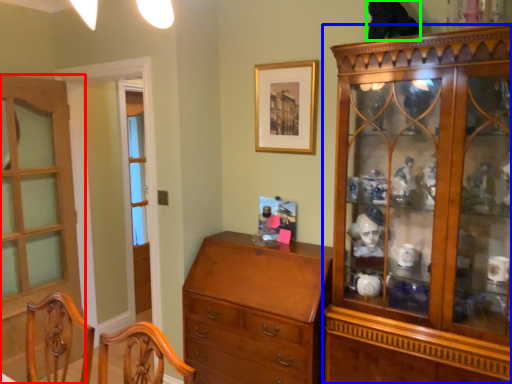
Question: Which object is the closest to the door (highlighted by a red box)? Choose among these: cabinetry (highlighted by a blue box) or animal (highlighted by a green box).

Choices:
 (A) cabinetry
 (B) animal

Answer: (A)